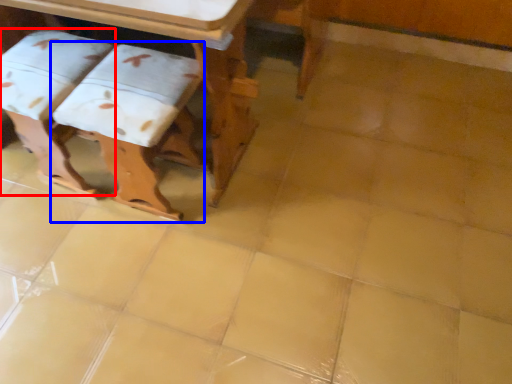
Question: Which object is further to the camera taking this photo, step stool (highlighted by a red box) or step stool (highlighted by a blue box)?

Choices:
 (A) step stool
 (B) step stool

Answer: (A)